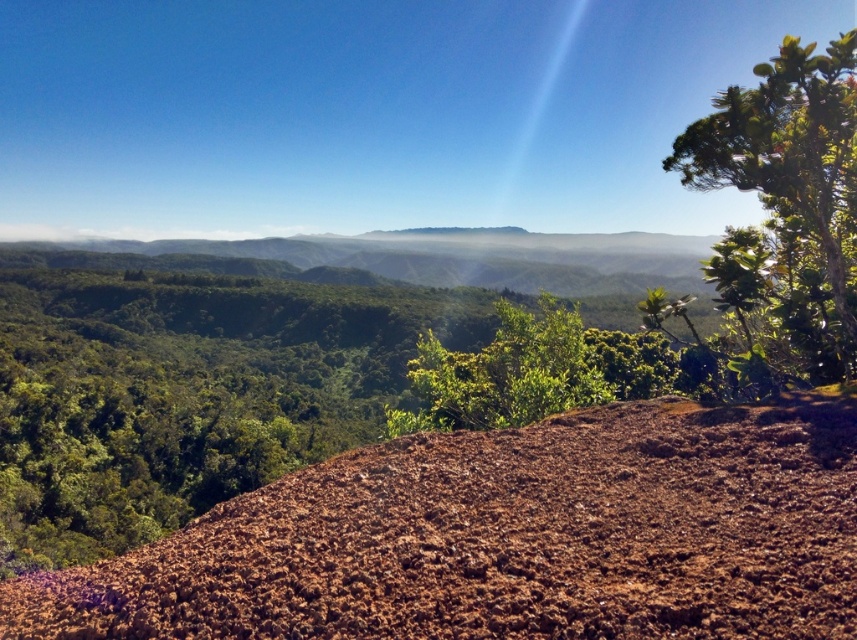
Which is more to the right, green leafy tree at upper right or green leafy bush at center?

green leafy tree at upper right

Is point (814, 182) more distant than point (417, 371)?

No.

At what (x,y) coordinates should I click in order to perform the action: click on green leafy tree at upper right. Please return your answer as a coordinate pair (x, y). The height and width of the screenshot is (640, 857). Looking at the image, I should click on (784, 144).

Image resolution: width=857 pixels, height=640 pixels. In order to click on green leafy tree at upper right in this screenshot , I will do `click(784, 144)`.

Can you confirm if brown textured soil at center is positioned below green leafy bush at center?

Actually, brown textured soil at center is above green leafy bush at center.

Between brown textured soil at center and green leafy bush at center, which one is positioned lower?

green leafy bush at center is below.

Is point (187, 540) more distant than point (567, 326)?

No.

I want to click on brown textured soil at center, so click(508, 538).

Is brown textured soil at center closer to the viewer compared to green leafy tree at upper right?

Yes, it is in front of green leafy tree at upper right.

Does brown textured soil at center have a greater height compared to green leafy tree at upper right?

Incorrect, brown textured soil at center's height is not larger of green leafy tree at upper right's.

Between point (433, 480) and point (724, 150), which one is positioned in front?

Point (433, 480)

The image size is (857, 640). Identify the location of brown textured soil at center. 508,538.